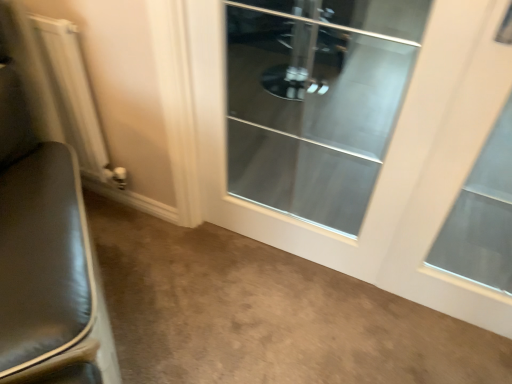
Question: Is point (458, 21) closer or farther from the camera than point (19, 211)?

Choices:
 (A) closer
 (B) farther

Answer: (A)

Question: Based on their positions, is clear glass door at center located to the left or right of black leather chair at left?

Choices:
 (A) right
 (B) left

Answer: (A)

Question: Which object is the closest to the white metallic radiator at left?

Choices:
 (A) transparent glass window at center
 (B) clear glass door at center
 (C) clear glass door at center
 (D) black leather chair at left

Answer: (D)

Question: Estimate the real-world distances between objects in this image. Which object is closer to the white metallic radiator at left?

Choices:
 (A) black leather chair at left
 (B) clear glass door at center
 (C) clear glass door at center
 (D) transparent glass window at center

Answer: (A)